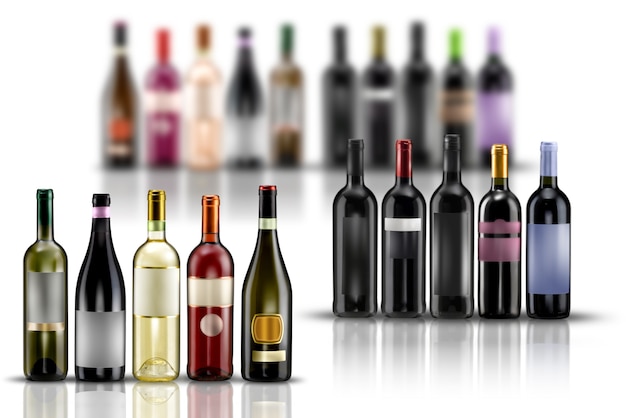
In order to click on row of wine bottles right side adjusted in this screenshot , I will do `click(356, 244)`, `click(391, 237)`, `click(453, 241)`, `click(508, 244)`, `click(553, 246)`.